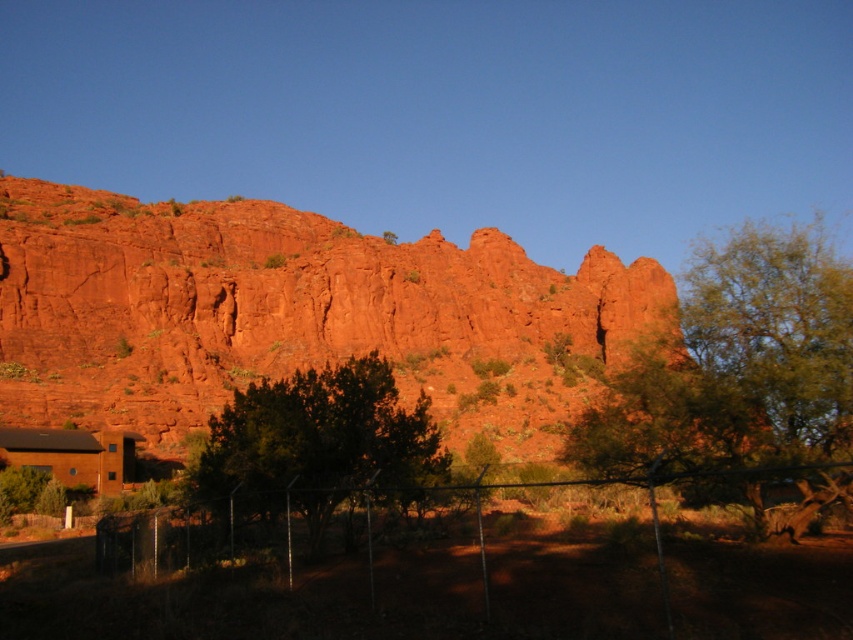
Is metallic chain-link fence at lower center smaller than green leafy tree at center?

Indeed, metallic chain-link fence at lower center has a smaller size compared to green leafy tree at center.

Does point (711, 540) come closer to viewer compared to point (358, 445)?

That is True.

This screenshot has width=853, height=640. In order to click on metallic chain-link fence at lower center in this screenshot , I will do `click(305, 541)`.

Does rustic rock formation at center appear on the right side of metallic chain-link fence at lower center?

In fact, rustic rock formation at center is to the left of metallic chain-link fence at lower center.

Is rustic rock formation at center in front of metallic chain-link fence at lower center?

No, it is behind metallic chain-link fence at lower center.

Does point (636, 282) come closer to viewer compared to point (375, 602)?

No, (636, 282) is further to viewer.

Where is `rustic rock formation at center`? This screenshot has width=853, height=640. rustic rock formation at center is located at coordinates (294, 314).

In the scene shown: Does green leafy tree at center-right have a lesser height compared to green leafy tree at center?

In fact, green leafy tree at center-right may be taller than green leafy tree at center.

Between green leafy tree at center-right and green leafy tree at center, which one has less height?

green leafy tree at center

Is point (845, 330) farther from viewer compared to point (202, 468)?

No, it is in front of (202, 468).

Identify the location of green leafy tree at center-right. Image resolution: width=853 pixels, height=640 pixels. (737, 364).